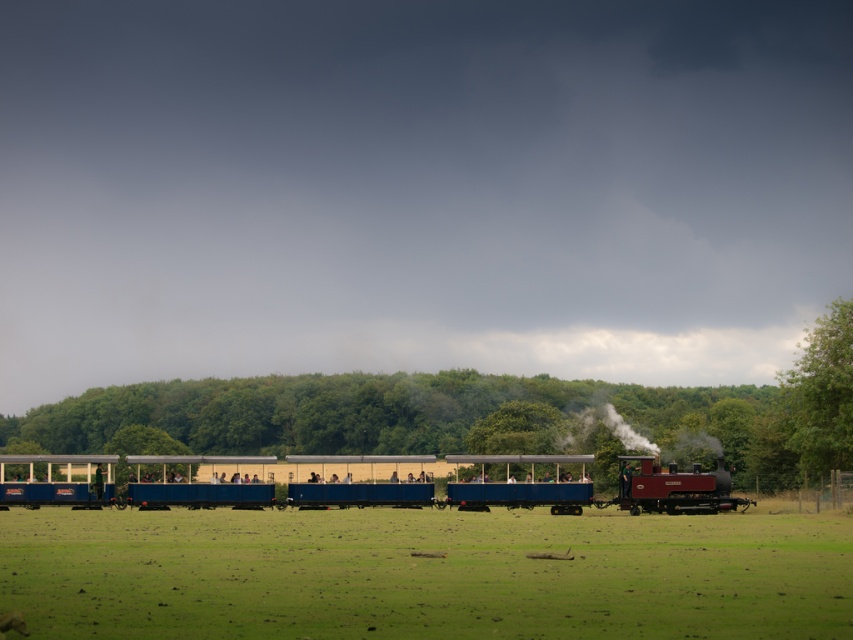
You are standing on the grassy field and see the blue painted wood train at center and the polished wood steam engine at center. Which object is nearer to you?

The blue painted wood train at center is closer to the viewer than the polished wood steam engine at center.

You are a passenger on the steam train and looking out the window. You notice green grass at lower center and green leafy tree at right. Which object is shorter?

The green grass at lower center is shorter than the green leafy tree at right.